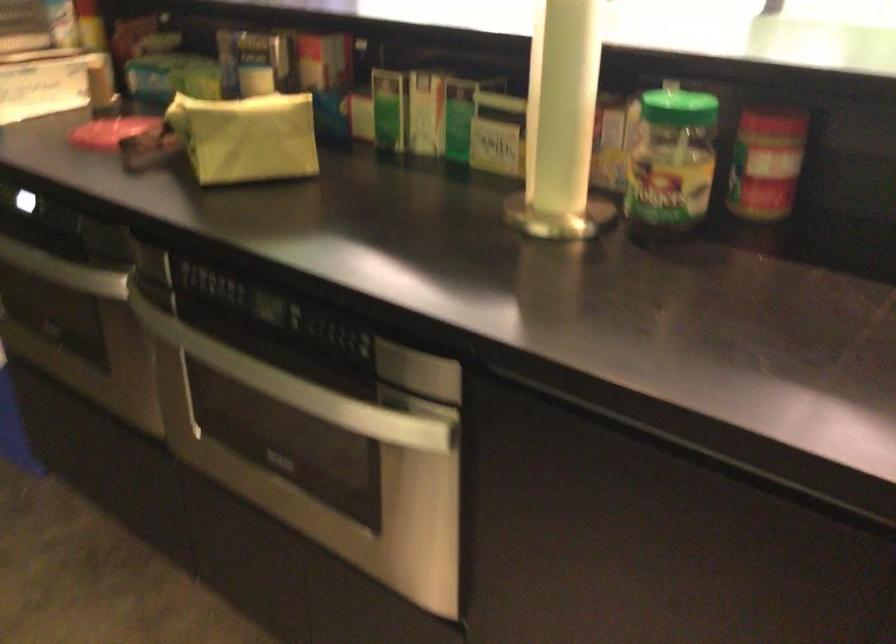
In order to click on yellow food pouch in this screenshot , I will do `click(246, 137)`.